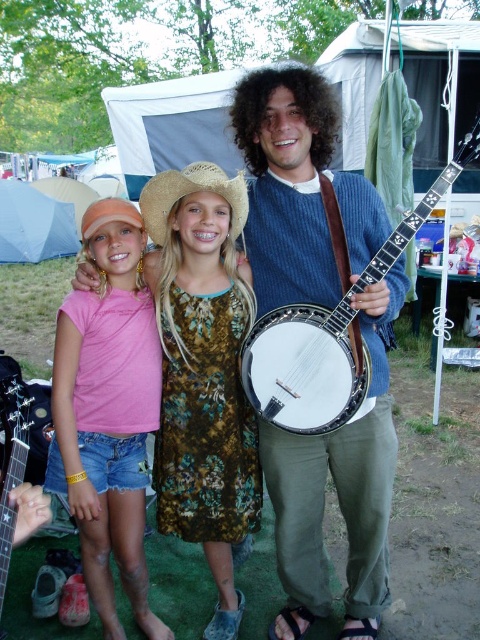
Question: Does pink fabric dress at center have a larger size compared to strawhat at center?

Choices:
 (A) no
 (B) yes

Answer: (B)

Question: Can you confirm if blue knitted sweater at center is wider than pink cotton shirt at left?

Choices:
 (A) yes
 (B) no

Answer: (A)

Question: Based on their relative distances, which object is farther from the strawhat at center?

Choices:
 (A) pink fabric dress at center
 (B) blue knitted sweater at center
 (C) wooden banjo at center
 (D) pink cotton shirt at left

Answer: (D)

Question: Which of the following is the farthest from the observer?

Choices:
 (A) strawhat at center
 (B) wooden banjo at center
 (C) pink fabric dress at center

Answer: (A)

Question: Can you confirm if pink cotton shirt at left is wider than strawhat at center?

Choices:
 (A) no
 (B) yes

Answer: (B)

Question: Which object is closer to the camera taking this photo?

Choices:
 (A) pink cotton shirt at left
 (B) pink fabric dress at center
 (C) wooden banjo at center
 (D) strawhat at center

Answer: (C)